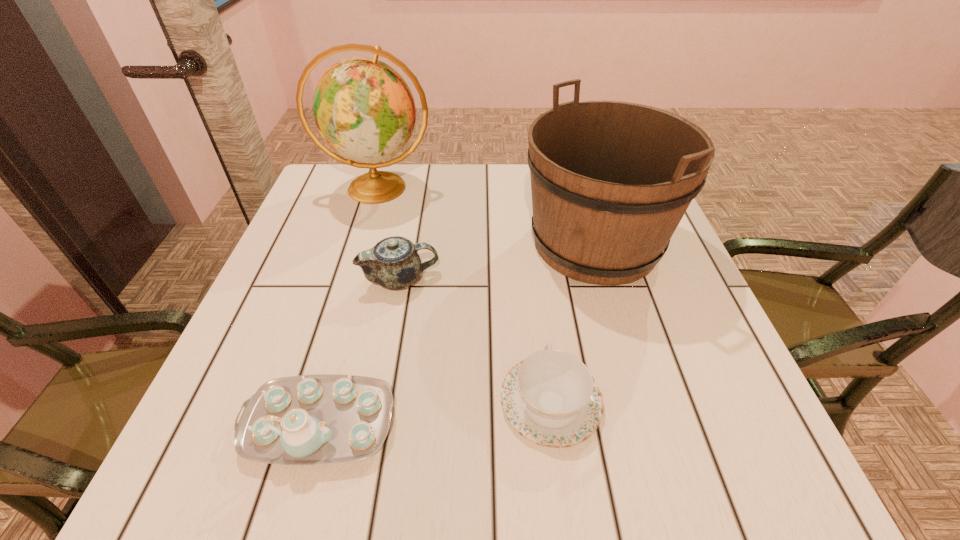
Locate an element on the screen. The height and width of the screenshot is (540, 960). object that stands as the second closest to the second tallest object is located at coordinates (393, 263).

Identify the location of the third closest chinaware relative to the second tallest object. (320, 419).

Identify which chinaware is the second nearest to the bucket. Please provide its 2D coordinates. Your answer should be formatted as a tuple, i.e. [(x, y)], where the tuple contains the x and y coordinates of a point satisfying the conditions above.

[(393, 263)]

This screenshot has height=540, width=960. In order to click on vacant area that satisfies the following two spatial constraints: 1. from the spout of the farthest chinaware; 2. on the handle side of the shortest chinaware in this screenshot , I will do `click(377, 402)`.

Find the location of a particular element. The image size is (960, 540). free location that satisfies the following two spatial constraints: 1. on the handle side of the shortest object; 2. on the right side of the bucket is located at coordinates (530, 243).

Locate an element on the screen. vacant area that satisfies the following two spatial constraints: 1. on the front side of the fourth shortest object; 2. on the left side of the globe is located at coordinates (361, 243).

Where is `free space that satisfies the following two spatial constraints: 1. on the handle side of the fourth shortest object; 2. on the right side of the shortest object`? free space that satisfies the following two spatial constraints: 1. on the handle side of the fourth shortest object; 2. on the right side of the shortest object is located at coordinates (530, 243).

Identify the location of free location that satisfies the following two spatial constraints: 1. on the front side of the bucket; 2. from the spout of the farthest chinaware. The image size is (960, 540). (606, 279).

I want to click on vacant area that satisfies the following two spatial constraints: 1. on the handle side of the shortest object; 2. from the spout of the farthest chinaware, so click(x=535, y=279).

The image size is (960, 540). What are the coordinates of `blank space that satisfies the following two spatial constraints: 1. on the handle side of the shortest object; 2. on the left side of the bucket` in the screenshot? It's located at (530, 243).